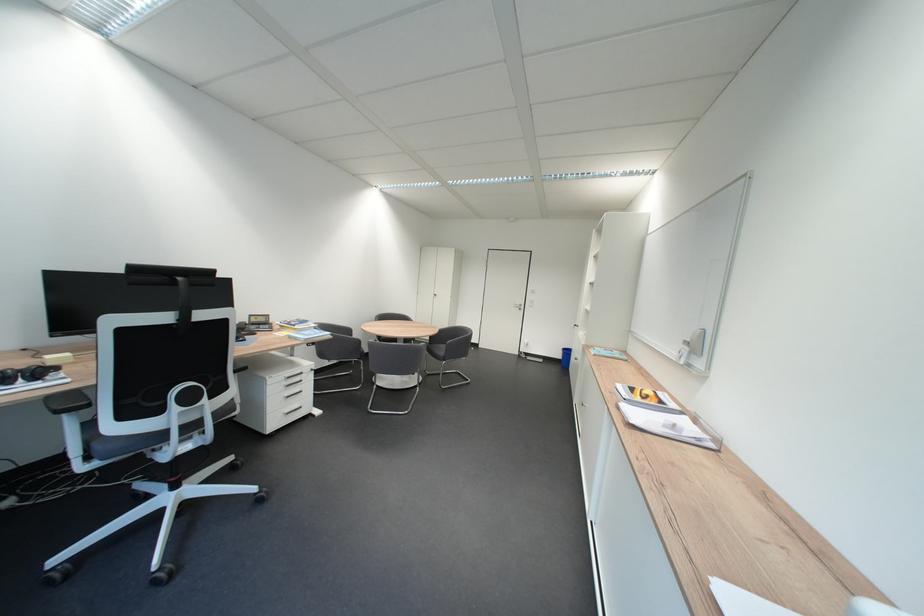
You are a GUI agent. You are given a task and a screenshot of the screen. Output one action in this format:
    pyautogui.click(x=<x>, y=<y>)
    Task: Click on the blue trash can
    The width and height of the screenshot is (924, 616).
    Given the screenshot: What is the action you would take?
    pyautogui.click(x=565, y=358)